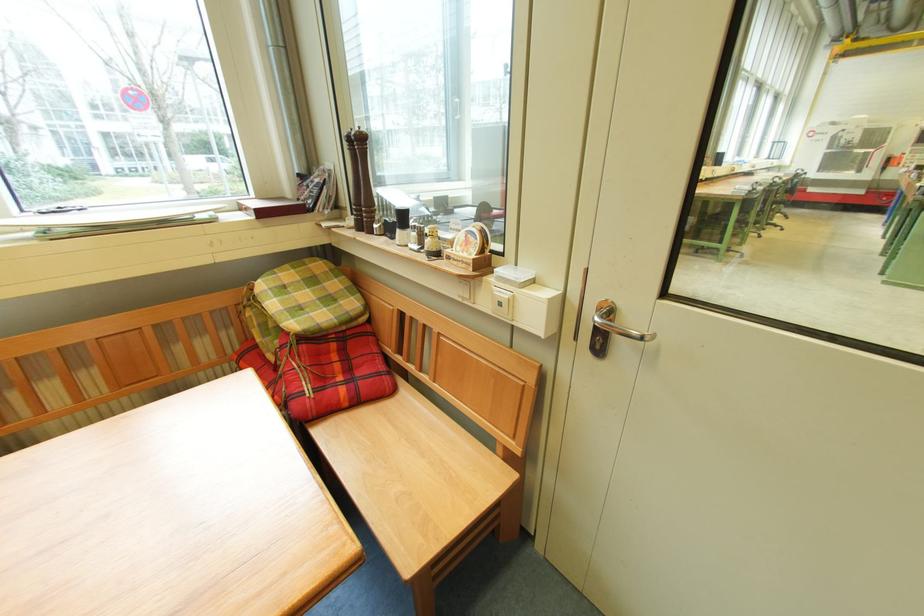
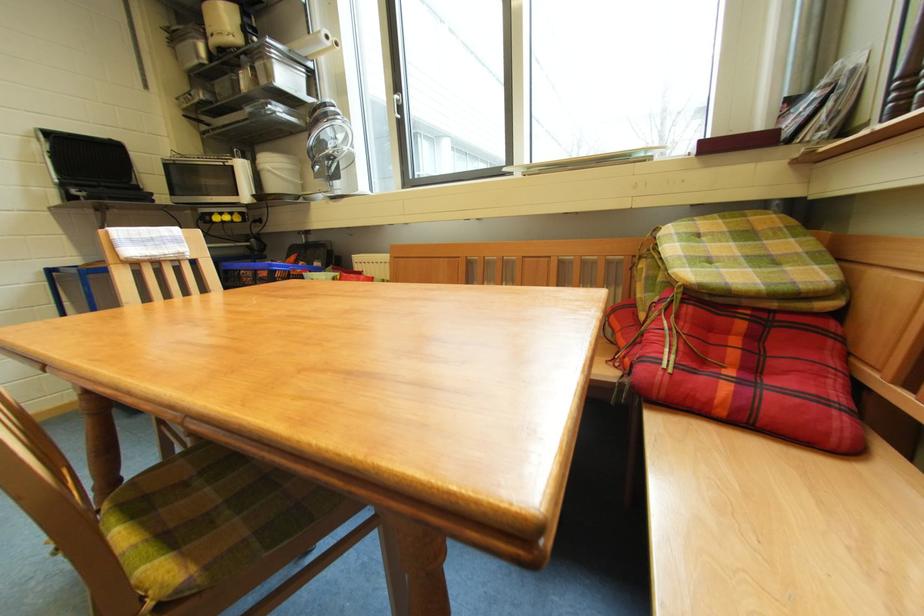
Question: Based on the continuous images, in which direction is the camera rotating? Reply with the corresponding letter.

Choices:
 (A) Left
 (B) Right
 (C) Up
 (D) Down

Answer: (A)